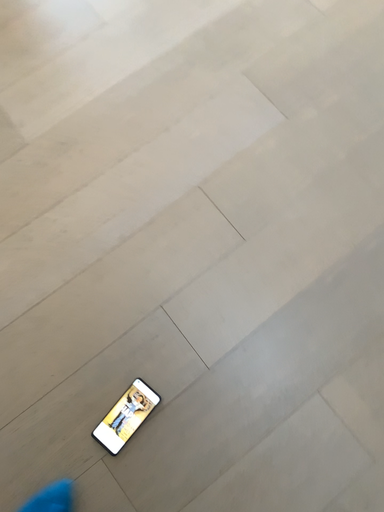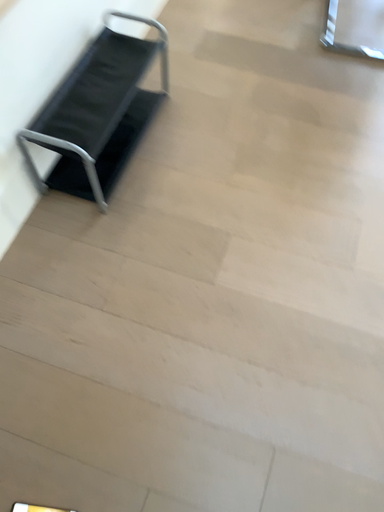
Question: How did the camera likely rotate when shooting the video?

Choices:
 (A) rotated upward
 (B) rotated downward

Answer: (A)